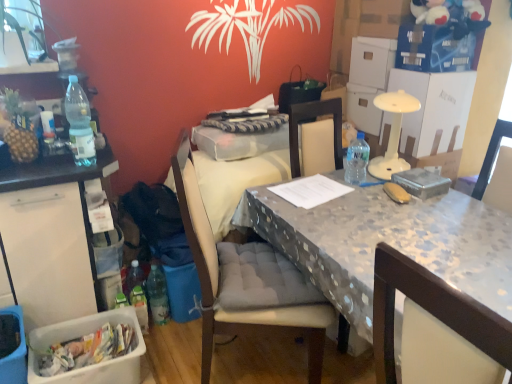
Question: Considering the positions of white plastic bin at left and plastic picnic basket at lower left in the image, is white plastic bin at left bigger or smaller than plastic picnic basket at lower left?

Choices:
 (A) small
 (B) big

Answer: (B)

Question: From a real-world perspective, relative to plastic picnic basket at lower left, is white plastic bin at left vertically above or below?

Choices:
 (A) above
 (B) below

Answer: (A)

Question: Which object is the closest to the polka dot fabric table at center?

Choices:
 (A) fabric cushioned chair at center
 (B) transparent plastic bottle at table right, the second bottle when ordered from back to front
 (C) white plastic container at lower left
 (D) translucent plastic bottle at lower left, which ranks as the 1th bottle in bottom-to-top order
 (E) plastic picnic basket at lower left

Answer: (A)

Question: Which is farther from the white plastic container at lower left?

Choices:
 (A) plastic picnic basket at lower left
 (B) fabric cushioned chair at center
 (C) translucent plastic bottle at lower left, the 1th bottle when ordered from back to front
 (D) translucent plastic bottle at left, arranged as the first bottle when viewed from the left
 (E) polka dot fabric table at center

Answer: (E)